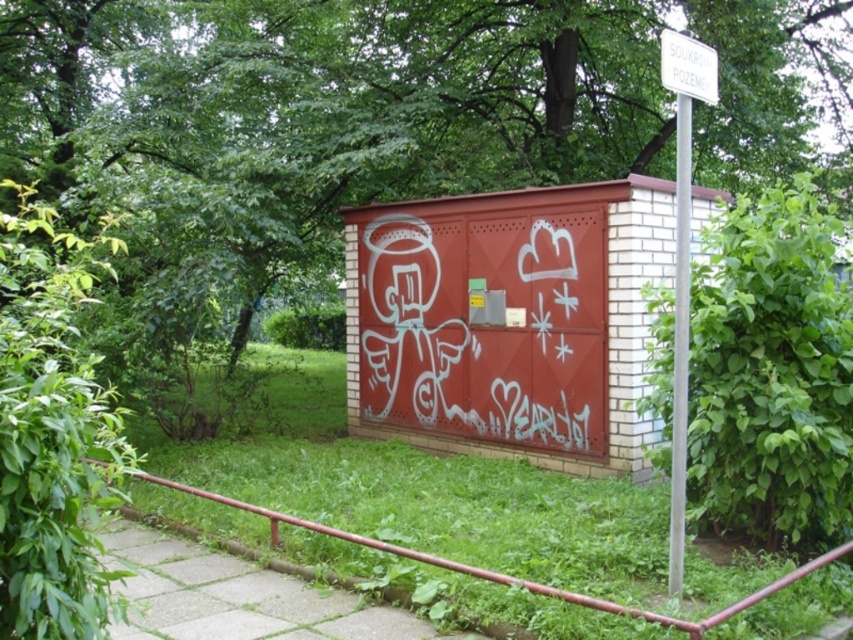
Based on the photo, does green leafy tree at upper center appear on the left side of white plastic sign at upper right?

Indeed, green leafy tree at upper center is positioned on the left side of white plastic sign at upper right.

Is green leafy tree at upper center wider than white plastic sign at upper right?

Indeed, green leafy tree at upper center has a greater width compared to white plastic sign at upper right.

Between point (312, 26) and point (683, 156), which one is positioned in front?

Point (683, 156) is more forward.

In order to click on green leafy tree at upper center in this screenshot , I will do `click(372, 115)`.

Does green leafy tree at upper center have a smaller size compared to white graffiti at center?

Incorrect, green leafy tree at upper center is not smaller in size than white graffiti at center.

Which is in front, point (521, 88) or point (376, 392)?

Point (376, 392)

Locate an element on the screen. green leafy tree at upper center is located at coordinates (372, 115).

Which of these two, white plastic sign at upper right or red metal rail at lower left, stands taller?

white plastic sign at upper right

Describe the element at coordinates (682, 259) in the screenshot. The width and height of the screenshot is (853, 640). I see `white plastic sign at upper right` at that location.

At what (x,y) coordinates should I click in order to perform the action: click on white plastic sign at upper right. Please return your answer as a coordinate pair (x, y). Looking at the image, I should click on [x=682, y=259].